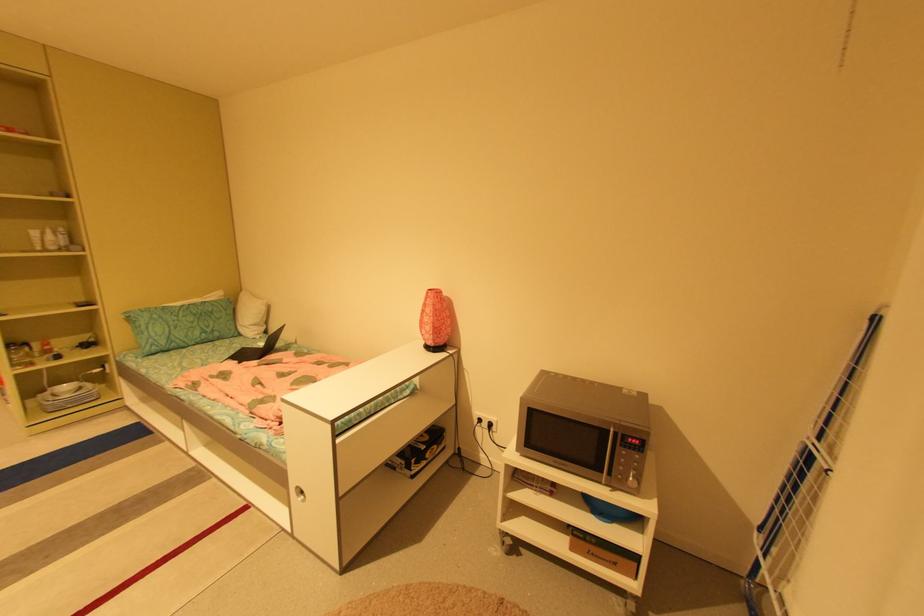
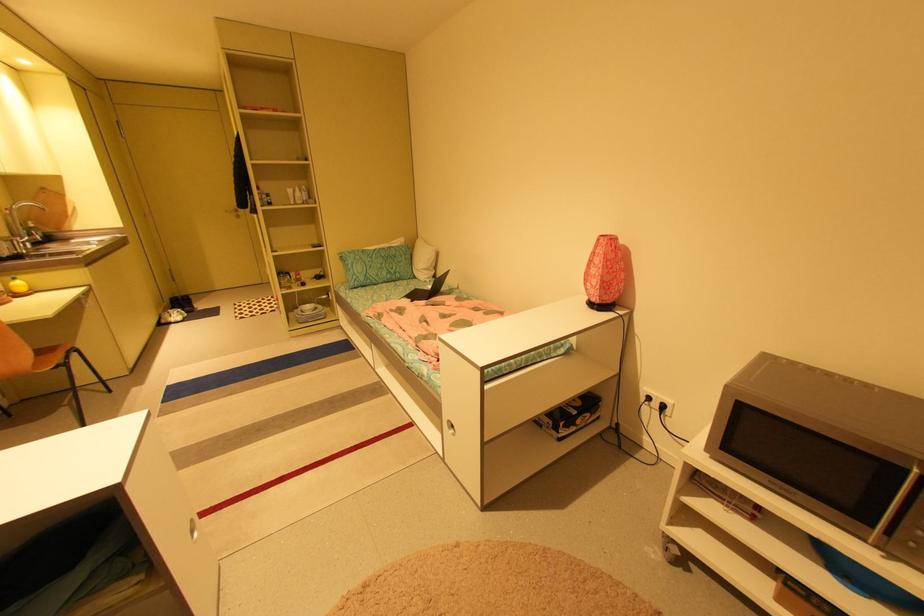
Find the pixel in the second image that matches (495,424) in the first image.

(669, 407)